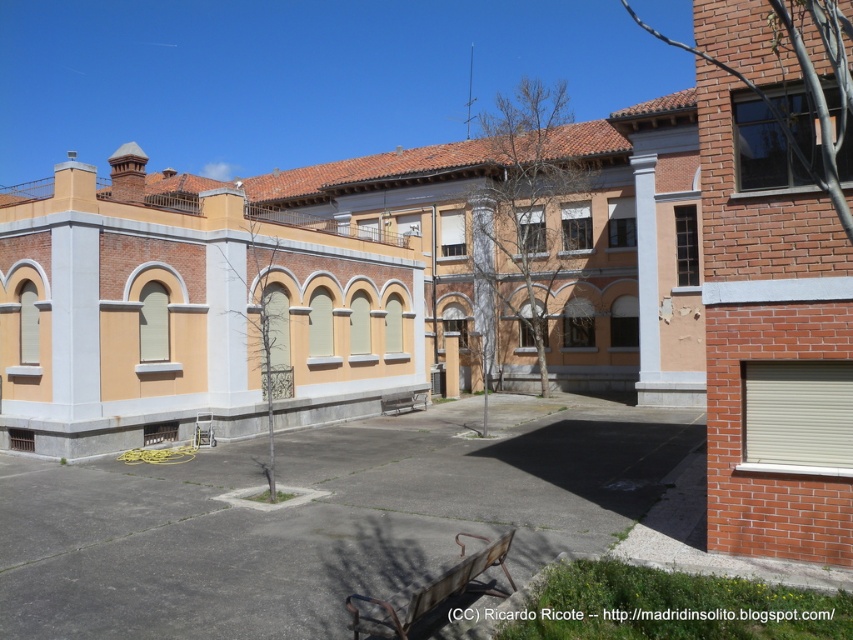
You are standing in the courtyard and want to walk towards the red brick building. There are two points marked in the image. Which point should you walk towards first, point (486,541) or point (407,410)?

You should walk towards point (486,541) first because it is in front of point (407,410), meaning it is closer to your current position.

You are a painter setting up your easel in the courtyard. You want to place your easel between the rustic wood park bench at lower center and the metallic silver bench at center. Which bench should you position your easel closer to if you need more space for your supplies?

You should position your easel closer to the metallic silver bench at center because the rustic wood park bench at lower center is much taller, which might block your view or workspace.